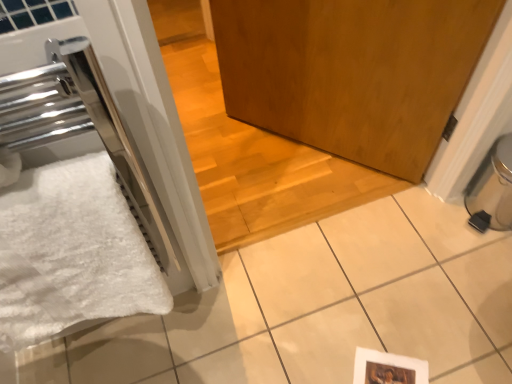
What do you see at coordinates (352, 72) in the screenshot? I see `wooden door at center` at bounding box center [352, 72].

In the scene shown: What is the approximate height of white fluffy bath towel at left?

white fluffy bath towel at left is 52.03 centimeters tall.

The width and height of the screenshot is (512, 384). Identify the location of black plastic water heater at lower right. (492, 189).

In order to click on water heater on the right of the wooden door at center in this screenshot , I will do `click(492, 189)`.

In the scene shown: From a real-world perspective, is black plastic water heater at lower right physically below wooden door at center?

Incorrect, from a real-world perspective, black plastic water heater at lower right is higher than wooden door at center.

Would you say black plastic water heater at lower right is inside or outside wooden door at center?

black plastic water heater at lower right is not enclosed by wooden door at center.

Can you confirm if black plastic water heater at lower right is positioned to the left of wooden door at center?

Incorrect, black plastic water heater at lower right is not on the left side of wooden door at center.

Can you confirm if wooden door at center is positioned to the left of white fluffy bath towel at left?

In fact, wooden door at center is to the right of white fluffy bath towel at left.

In terms of height, does wooden door at center look taller or shorter compared to white fluffy bath towel at left?

Clearly, wooden door at center is shorter compared to white fluffy bath towel at left.

Does point (473, 18) come closer to viewer compared to point (33, 294)?

No.

Is point (293, 16) closer to viewer compared to point (477, 205)?

Yes, point (293, 16) is closer to viewer.

In the scene shown: Choose the correct answer: Is wooden door at center inside black plastic water heater at lower right or outside it?

wooden door at center lies outside black plastic water heater at lower right.

Considering the relative positions of wooden door at center and black plastic water heater at lower right in the image provided, is wooden door at center to the left or to the right of black plastic water heater at lower right?

Based on their positions, wooden door at center is located to the left of black plastic water heater at lower right.

From a real-world perspective, who is located higher, wooden door at center or black plastic water heater at lower right?

black plastic water heater at lower right, from a real-world perspective.

Considering the relative sizes of white fluffy bath towel at left and wooden door at center in the image provided, is white fluffy bath towel at left wider than wooden door at center?

No, white fluffy bath towel at left is not wider than wooden door at center.

You are a GUI agent. You are given a task and a screenshot of the screen. Output one action in this format:
    pyautogui.click(x=<x>, y=<y>)
    Task: Click on the door on the right of white fluffy bath towel at left
    
    Given the screenshot: What is the action you would take?
    pyautogui.click(x=352, y=72)

From their relative heights in the image, would you say white fluffy bath towel at left is taller or shorter than wooden door at center?

In the image, white fluffy bath towel at left appears to be taller than wooden door at center.

Is white fluffy bath towel at left oriented away from black plastic water heater at lower right?

No.

Based on their positions, is white fluffy bath towel at left located to the left or right of black plastic water heater at lower right?

Based on their positions, white fluffy bath towel at left is located to the left of black plastic water heater at lower right.

From a real-world perspective, is white fluffy bath towel at left over black plastic water heater at lower right?

Yes, from a real-world perspective, white fluffy bath towel at left is over black plastic water heater at lower right

Which is less distant, [471,214] or [32,336]?

Positioned in front is point [32,336].

Identify the location of water heater above the white fluffy bath towel at left (from the image's perspective). The image size is (512, 384). (492, 189).

Considering the relative sizes of black plastic water heater at lower right and white fluffy bath towel at left in the image provided, is black plastic water heater at lower right smaller than white fluffy bath towel at left?

Yes.

At what (x,y) coordinates should I click in order to perform the action: click on water heater that is in front of the wooden door at center. Please return your answer as a coordinate pair (x, y). Looking at the image, I should click on (492, 189).

Locate an element on the screen. The image size is (512, 384). door above the white fluffy bath towel at left (from the image's perspective) is located at coordinates (352, 72).

Which object lies nearer to the anchor point wooden door at center, black plastic water heater at lower right or white fluffy bath towel at left?

black plastic water heater at lower right.

From the image, which object appears to be farther from white fluffy bath towel at left, black plastic water heater at lower right or wooden door at center?

black plastic water heater at lower right is further to white fluffy bath towel at left.

Looking at the image, which one is located closer to white fluffy bath towel at left, wooden door at center or black plastic water heater at lower right?

wooden door at center is positioned closer to the anchor white fluffy bath towel at left.

Which object lies further to the anchor point black plastic water heater at lower right, wooden door at center or white fluffy bath towel at left?

white fluffy bath towel at left.

Looking at the image, which one is located closer to black plastic water heater at lower right, white fluffy bath towel at left or wooden door at center?

Based on the image, wooden door at center appears to be nearer to black plastic water heater at lower right.

From the image, which object appears to be nearer to wooden door at center, white fluffy bath towel at left or black plastic water heater at lower right?

The object closer to wooden door at center is black plastic water heater at lower right.

Locate an element on the screen. The width and height of the screenshot is (512, 384). door between white fluffy bath towel at left and black plastic water heater at lower right from left to right is located at coordinates (352, 72).